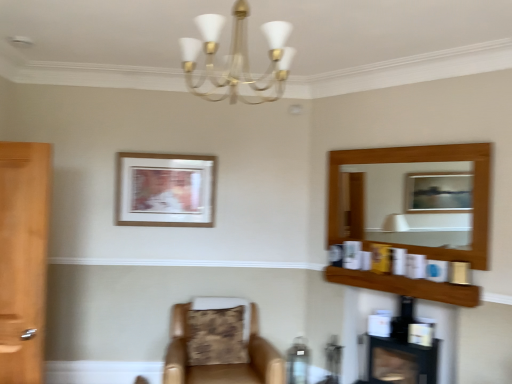
What do you see at coordinates (216, 336) in the screenshot? Image resolution: width=512 pixels, height=384 pixels. I see `brown textured pillow at lower center` at bounding box center [216, 336].

Describe the element at coordinates (237, 57) in the screenshot. The image size is (512, 384). I see `gold metallic chandelier at upper center` at that location.

In order to click on leather at center in this screenshot , I will do `click(221, 364)`.

Image resolution: width=512 pixels, height=384 pixels. Find the location of `wooden shelf at upper right`. wooden shelf at upper right is located at coordinates (407, 286).

Does gold metallic chandelier at upper center have a greater height compared to leather at center?

In fact, gold metallic chandelier at upper center may be shorter than leather at center.

From a real-world perspective, is gold metallic chandelier at upper center under leather at center?

No, from a real-world perspective, gold metallic chandelier at upper center is not beneath leather at center.

Can you see gold metallic chandelier at upper center touching leather at center?

They are not placed beside each other.

How different are the orientations of gold metallic chandelier at upper center and leather at center in degrees?

The angle between the facing direction of gold metallic chandelier at upper center and the facing direction of leather at center is 95.3 degrees.

Is leather at center located outside matte brown table at lower center?

That's correct, leather at center is outside of matte brown table at lower center.

In terms of height, does leather at center look taller or shorter compared to matte brown table at lower center?

leather at center is taller than matte brown table at lower center.

Is leather at center facing away from matte brown table at lower center?

leather at center does not have its back to matte brown table at lower center.

Does point (227, 369) come farther from viewer compared to point (317, 367)?

No.

Do you think wooden shelf at upper right is within black glossy fireplace at lower right, or outside of it?

wooden shelf at upper right is outside black glossy fireplace at lower right.

What's the angular difference between wooden shelf at upper right and black glossy fireplace at lower right's facing directions?

They differ by 0.946 degrees in their facing directions.

Does wooden shelf at upper right appear on the right side of black glossy fireplace at lower right?

No.

Is black glossy fireplace at lower right at the back of wooden shelf at upper right?

No, wooden shelf at upper right's orientation is not away from black glossy fireplace at lower right.

From a real-world perspective, who is located lower, gold metallic chandelier at upper center or wooden shelf at upper right?

From a 3D spatial view, wooden shelf at upper right is below.

Based on the photo, who is more distant, gold metallic chandelier at upper center or wooden shelf at upper right?

wooden shelf at upper right.

Can you confirm if gold metallic chandelier at upper center is shorter than wooden shelf at upper right?

Incorrect, the height of gold metallic chandelier at upper center does not fall short of that of wooden shelf at upper right.

Is gold metallic chandelier at upper center positioned far away from wooden shelf at upper right?

Indeed, gold metallic chandelier at upper center is not near wooden shelf at upper right.

Which object is positioned more to the left, black glossy fireplace at lower right or leather at center?

From the viewer's perspective, leather at center appears more on the left side.

Looking at this image, from the image's perspective, would you say black glossy fireplace at lower right is positioned over leather at center?

Yes, from the image's perspective, black glossy fireplace at lower right is over leather at center.

Based on their sizes in the image, would you say black glossy fireplace at lower right is bigger or smaller than leather at center?

Considering their sizes, black glossy fireplace at lower right takes up less space than leather at center.

Looking at this image, in the image, is black glossy fireplace at lower right positioned in front of or behind leather at center?

black glossy fireplace at lower right is behind leather at center.

Looking at this image, is wooden picture frame at upper center placed right next to wooden shelf at upper right?

They are not placed beside each other.

In the scene shown: Does wooden picture frame at upper center have a lesser width compared to wooden shelf at upper right?

Yes, wooden picture frame at upper center is thinner than wooden shelf at upper right.

Looking at this image, considering their positions, is wooden picture frame at upper center located in front of or behind wooden shelf at upper right?

wooden picture frame at upper center is positioned farther from the viewer than wooden shelf at upper right.

From the image's perspective, which is above, wooden picture frame at upper center or wooden shelf at upper right?

From the image's view, wooden picture frame at upper center is above.

Is brown textured pillow at lower center not near leather at center?

No, brown textured pillow at lower center is in close proximity to leather at center.

Visually, is brown textured pillow at lower center positioned to the left or to the right of leather at center?

In the image, brown textured pillow at lower center appears on the left side of leather at center.

Choose the correct answer: Is brown textured pillow at lower center inside leather at center or outside it?

brown textured pillow at lower center fits inside leather at center.

Where is `light fixture in front of the leather at center`? light fixture in front of the leather at center is located at coordinates (237, 57).

Where is `round table that appears below the leather at center (from a real-world perspective)`? This screenshot has width=512, height=384. round table that appears below the leather at center (from a real-world perspective) is located at coordinates (316, 374).

Based on their spatial positions, is gold metallic chandelier at upper center or wooden picture frame at upper center closer to black glossy fireplace at lower right?

wooden picture frame at upper center.

When comparing their distances from wooden picture frame at upper center, does matte brown table at lower center or gold metallic chandelier at upper center seem closer?

The object closer to wooden picture frame at upper center is gold metallic chandelier at upper center.

Which object lies nearer to the anchor point matte brown table at lower center, leather at center or black glossy fireplace at lower right?

black glossy fireplace at lower right is positioned closer to the anchor matte brown table at lower center.

Estimate the real-world distances between objects in this image. Which object is closer to wooden shelf at upper right, black glossy fireplace at lower right or gold metallic chandelier at upper center?

Among the two, black glossy fireplace at lower right is located nearer to wooden shelf at upper right.

From the image, which object appears to be farther from matte brown table at lower center, gold metallic chandelier at upper center or brown textured pillow at lower center?

gold metallic chandelier at upper center is positioned further to the anchor matte brown table at lower center.

Considering their positions, is gold metallic chandelier at upper center positioned closer to leather at center than black glossy fireplace at lower right?

black glossy fireplace at lower right.

Considering their positions, is wooden shelf at upper right positioned closer to black glossy fireplace at lower right than brown textured pillow at lower center?

wooden shelf at upper right is closer to black glossy fireplace at lower right.

Looking at the image, which one is located further to brown textured pillow at lower center, leather at center or wooden shelf at upper right?

wooden shelf at upper right.

You are a GUI agent. You are given a task and a screenshot of the screen. Output one action in this format:
    pyautogui.click(x=<x>, y=<y>)
    Task: Click on the pillow between gold metallic chandelier at upper center and matte brown table at lower center from front to back
    This screenshot has height=384, width=512.
    Given the screenshot: What is the action you would take?
    pyautogui.click(x=216, y=336)

The width and height of the screenshot is (512, 384). I want to click on round table situated between brown textured pillow at lower center and black glossy fireplace at lower right from left to right, so click(x=316, y=374).

Identify the location of round table between leather at center and wooden shelf at upper right from left to right. (316, 374).

Where is `chair located between brown textured pillow at lower center and matte brown table at lower center in the left-right direction`? This screenshot has height=384, width=512. chair located between brown textured pillow at lower center and matte brown table at lower center in the left-right direction is located at coordinates (221, 364).